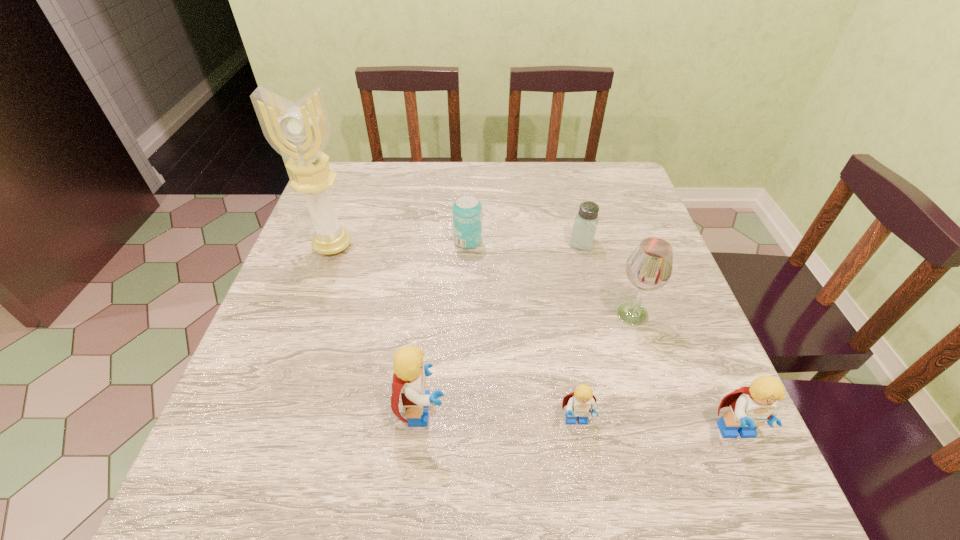
This screenshot has width=960, height=540. I want to click on blank region between the leftmost Lego and the beer can, so click(x=445, y=326).

This screenshot has width=960, height=540. I want to click on free area in between the leftmost object and the leftmost Lego, so tap(378, 328).

At what (x,y) coordinates should I click in order to perform the action: click on unoccupied position between the beer can and the leftmost object. Please return your answer as a coordinate pair (x, y). Looking at the image, I should click on (400, 244).

You are a GUI agent. You are given a task and a screenshot of the screen. Output one action in this format:
    pyautogui.click(x=<x>, y=<y>)
    Task: Click on the vacant area that lies between the fourth shortest object and the beer can
    
    Given the screenshot: What is the action you would take?
    pyautogui.click(x=602, y=337)

At what (x,y) coordinates should I click in order to perform the action: click on vacant region between the shortest Lego and the tallest object. Please return your answer as a coordinate pair (x, y). Looking at the image, I should click on (455, 334).

Where is `object that stands as the second closest to the fourth nearest object`? The height and width of the screenshot is (540, 960). object that stands as the second closest to the fourth nearest object is located at coordinates (750, 407).

At what (x,y) coordinates should I click in order to perform the action: click on object that stands as the fourth closest to the saltshaker. Please return your answer as a coordinate pair (x, y). Looking at the image, I should click on (750, 407).

I want to click on Lego identified as the closest to the second shortest Lego, so click(579, 403).

Find the location of a particular element. The height and width of the screenshot is (540, 960). Lego that can be found as the second closest to the shortest Lego is located at coordinates (750, 407).

At what (x,y) coordinates should I click in order to perform the action: click on vacant area that satisfies the following two spatial constraints: 1. on the front side of the beer can; 2. on the right side of the fourth farthest object. Please return your answer as a coordinate pair (x, y). This screenshot has height=540, width=960. Looking at the image, I should click on (466, 314).